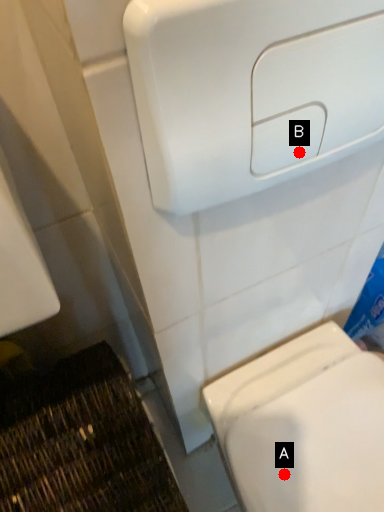
Question: Two points are circled on the image, labeled by A and B beside each circle. Among these points, which one is nearest to the camera?

Choices:
 (A) A is closer
 (B) B is closer

Answer: (B)